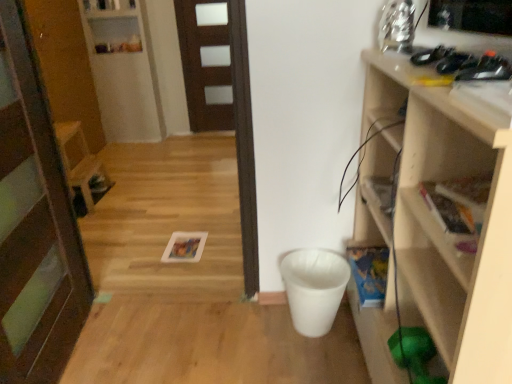
Image resolution: width=512 pixels, height=384 pixels. What do you see at coordinates (124, 73) in the screenshot? I see `white glossy shelf at upper left, marked as the 1th shelf in a top-to-bottom arrangement` at bounding box center [124, 73].

Find the location of a particular element. Image resolution: width=512 pixels, height=384 pixels. brown matte door at center, the second door ordered from the bottom is located at coordinates (206, 63).

Does point (9, 380) lie in front of point (490, 140)?

That is False.

Does wooden door at center, which appears as the first door when viewed from the front, come behind wooden shelf at right, which ranks as the 2th shelf in top-to-bottom order?

Yes.

Is wooden door at center, the 2th door in the back-to-front sequence, oriented towards wooden shelf at right, which ranks as the 2th shelf in top-to-bottom order?

No.

Locate an element on the screen. This screenshot has width=512, height=384. the 2nd door positioned above the wooden shelf at right, which ranks as the 2th shelf in top-to-bottom order (from a real-world perspective) is located at coordinates (34, 225).

You are a GUI agent. You are given a task and a screenshot of the screen. Output one action in this format:
    pyautogui.click(x=<x>, y=<y>)
    Task: Click on the door above the brown matte door at center, which is the 2th door in left-to-right order (from a real-world perspective)
    The height and width of the screenshot is (384, 512).
    Given the screenshot: What is the action you would take?
    pyautogui.click(x=34, y=225)

Is wooden door at center, marked as the second door in a right-to-left arrangement, touching brown matte door at center, acting as the first door starting from the top?

No, wooden door at center, marked as the second door in a right-to-left arrangement, is not making contact with brown matte door at center, acting as the first door starting from the top.

From a real-world perspective, does wooden door at center, which appears as the first door when viewed from the front, sit lower than brown matte door at center, which appears as the second door when viewed from the front?

No.

Can you confirm if white glossy shelf at upper left, the second shelf when ordered from bottom to top, is taller than wooden chair at left?

Indeed, white glossy shelf at upper left, the second shelf when ordered from bottom to top, has a greater height compared to wooden chair at left.

Is white glossy shelf at upper left, which ranks as the 2th shelf in front-to-back order, inside the boundaries of wooden chair at left, or outside?

white glossy shelf at upper left, which ranks as the 2th shelf in front-to-back order, is located beyond the bounds of wooden chair at left.

Considering the positions of objects white glossy shelf at upper left, which ranks as the 2th shelf in front-to-back order, and wooden chair at left in the image provided, who is more to the right, white glossy shelf at upper left, which ranks as the 2th shelf in front-to-back order, or wooden chair at left?

From the viewer's perspective, white glossy shelf at upper left, which ranks as the 2th shelf in front-to-back order, appears more on the right side.

From the image's perspective, does white glossy shelf at upper left, the first shelf positioned from the left, appear lower than wooden chair at left?

Actually, white glossy shelf at upper left, the first shelf positioned from the left, appears above wooden chair at left in the image.

How different are the orientations of wooden chair at left and wooden shelf at right, the 2th shelf positioned from the left, in degrees?

179 degrees separate the facing orientations of wooden chair at left and wooden shelf at right, the 2th shelf positioned from the left.

From a real-world perspective, is wooden chair at left above or below wooden shelf at right, which ranks as the 2th shelf in top-to-bottom order?

From a real-world perspective, wooden chair at left is physically below wooden shelf at right, which ranks as the 2th shelf in top-to-bottom order.

Which is behind, wooden chair at left or wooden shelf at right, acting as the first shelf starting from the bottom?

Positioned behind is wooden chair at left.

At what (x,y) coordinates should I click in order to perform the action: click on shelf below the wooden chair at left (from the image's perspective). Please return your answer as a coordinate pair (x, y). Looking at the image, I should click on (436, 223).

From a real-world perspective, is wooden shelf at right, the 2th shelf positioned from the left, physically below wooden chair at left?

No, from a real-world perspective, wooden shelf at right, the 2th shelf positioned from the left, is not below wooden chair at left.

Considering the positions of objects wooden shelf at right, the 2th shelf positioned from the left, and wooden chair at left in the image provided, who is in front, wooden shelf at right, the 2th shelf positioned from the left, or wooden chair at left?

wooden shelf at right, the 2th shelf positioned from the left, is more forward.

Considering the relative positions of white glossy shelf at upper left, the 1th shelf in the back-to-front sequence, and wooden door at center, the 2th door in the back-to-front sequence, in the image provided, is white glossy shelf at upper left, the 1th shelf in the back-to-front sequence, to the left of wooden door at center, the 2th door in the back-to-front sequence, from the viewer's perspective?

Yes.

Who is smaller, white glossy shelf at upper left, the second shelf when ordered from bottom to top, or wooden door at center, which ranks as the 1th door in left-to-right order?

wooden door at center, which ranks as the 1th door in left-to-right order, is smaller.

Considering the relative sizes of white glossy shelf at upper left, the first shelf positioned from the left, and wooden door at center, marked as the second door in a right-to-left arrangement, in the image provided, is white glossy shelf at upper left, the first shelf positioned from the left, shorter than wooden door at center, marked as the second door in a right-to-left arrangement,?

Indeed, white glossy shelf at upper left, the first shelf positioned from the left, has a lesser height compared to wooden door at center, marked as the second door in a right-to-left arrangement.

How much distance is there between white glossy shelf at upper left, the 1th shelf in the back-to-front sequence, and wooden door at center, the 2th door in the back-to-front sequence?

They are 8.02 feet apart.

Is brown matte door at center, acting as the first door starting from the top, oriented away from wooden door at center, which appears as the first door when viewed from the front?

brown matte door at center, acting as the first door starting from the top, does not have its back to wooden door at center, which appears as the first door when viewed from the front.

Can you confirm if brown matte door at center, the second door ordered from the bottom, is taller than wooden door at center, which appears as the first door when viewed from the front?

No, brown matte door at center, the second door ordered from the bottom, is not taller than wooden door at center, which appears as the first door when viewed from the front.

Identify the location of door on the left of brown matte door at center, which is the 2th door in left-to-right order. (34, 225).

Does point (216, 28) appear closer or farther from the camera than point (31, 378)?

Point (216, 28) is farther from the camera than point (31, 378).

Image resolution: width=512 pixels, height=384 pixels. I want to click on shelf located on the right of wooden door at center, the 2th door from the top, so click(436, 223).

In the image, there is a wooden door at center, which is the 1th door in bottom-to-top order. Where is `door above it (from the image's perspective)`? The height and width of the screenshot is (384, 512). door above it (from the image's perspective) is located at coordinates (206, 63).

Looking at the image, which one is located further to brown matte door at center, which is the 2th door in left-to-right order, wooden chair at left or wooden shelf at right, which ranks as the 2th shelf in top-to-bottom order?

Based on the image, wooden shelf at right, which ranks as the 2th shelf in top-to-bottom order, appears to be further to brown matte door at center, which is the 2th door in left-to-right order.

From the image, which object appears to be nearer to wooden shelf at right, the 2th shelf positioned from the left, white glossy shelf at upper left, which ranks as the 2th shelf in front-to-back order, or wooden chair at left?

wooden chair at left.

From the image, which object appears to be farther from wooden shelf at right, which ranks as the 2th shelf in top-to-bottom order, wooden chair at left or white glossy shelf at upper left, the first shelf positioned from the left?

white glossy shelf at upper left, the first shelf positioned from the left, is further to wooden shelf at right, which ranks as the 2th shelf in top-to-bottom order.

Based on their spatial positions, is white glossy shelf at upper left, the 1th shelf in the back-to-front sequence, or wooden shelf at right, which ranks as the 2th shelf in top-to-bottom order, further from wooden chair at left?

The object further to wooden chair at left is wooden shelf at right, which ranks as the 2th shelf in top-to-bottom order.

From the image, which object appears to be farther from white glossy shelf at upper left, the 1th shelf in the back-to-front sequence, wooden chair at left or brown matte door at center, acting as the first door starting from the right?

wooden chair at left is positioned further to the anchor white glossy shelf at upper left, the 1th shelf in the back-to-front sequence.

Based on their spatial positions, is wooden door at center, which ranks as the 1th door in left-to-right order, or brown matte door at center, which appears as the second door when viewed from the front, further from wooden shelf at right, acting as the first shelf starting from the bottom?

brown matte door at center, which appears as the second door when viewed from the front, is positioned further to the anchor wooden shelf at right, acting as the first shelf starting from the bottom.

Based on their spatial positions, is wooden door at center, which ranks as the 1th door in left-to-right order, or wooden shelf at right, acting as the first shelf starting from the bottom, closer to wooden chair at left?

wooden door at center, which ranks as the 1th door in left-to-right order, lies closer to wooden chair at left than the other object.

Estimate the real-world distances between objects in this image. Which object is closer to brown matte door at center, which is the 2th door in left-to-right order, white glossy shelf at upper left, which ranks as the 2th shelf in front-to-back order, or wooden shelf at right, marked as the 1th shelf in a front-to-back arrangement?

white glossy shelf at upper left, which ranks as the 2th shelf in front-to-back order, is closer to brown matte door at center, which is the 2th door in left-to-right order.

Find the location of `shelf positioned between wooden chair at left and brown matte door at center, placed as the 1th door when sorted from back to front, from near to far`. shelf positioned between wooden chair at left and brown matte door at center, placed as the 1th door when sorted from back to front, from near to far is located at coordinates (124, 73).

Where is `shelf between wooden door at center, which appears as the first door when viewed from the front, and brown matte door at center, acting as the first door starting from the top, from front to back`? shelf between wooden door at center, which appears as the first door when viewed from the front, and brown matte door at center, acting as the first door starting from the top, from front to back is located at coordinates (124, 73).

At what (x,y) coordinates should I click in order to perform the action: click on shelf between wooden shelf at right, the 2th shelf positioned from the left, and brown matte door at center, which appears as the second door when viewed from the front, along the z-axis. Please return your answer as a coordinate pair (x, y). Image resolution: width=512 pixels, height=384 pixels. Looking at the image, I should click on (124, 73).

Locate an element on the screen. chair positioned between wooden shelf at right, the 2th shelf positioned from the left, and brown matte door at center, the second door ordered from the bottom, from near to far is located at coordinates (81, 164).